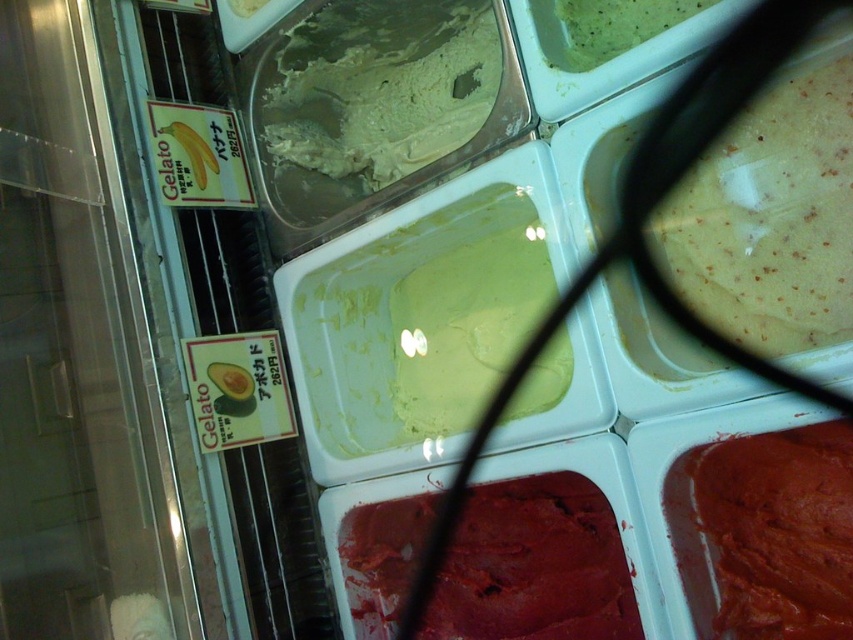
In the scene shown: You are standing in front of the display case and want to reach the gelato containers. The gelato containers are located at point (415, 240). If your arm can extend 3 feet, can you reach them?

The distance between point (415, 240) and the camera is 3.80 feet. Since your arm can only extend 3 feet, you cannot reach the gelato containers at point (415, 240).

You are a customer at the gelato shop and want to point out the green matte gelato at center and the smooth red gelato at bottom right to the cashier. Which one is closer to the left side of the display case?

The green matte gelato at center is closer to the left side of the display case than the smooth red gelato at bottom right.